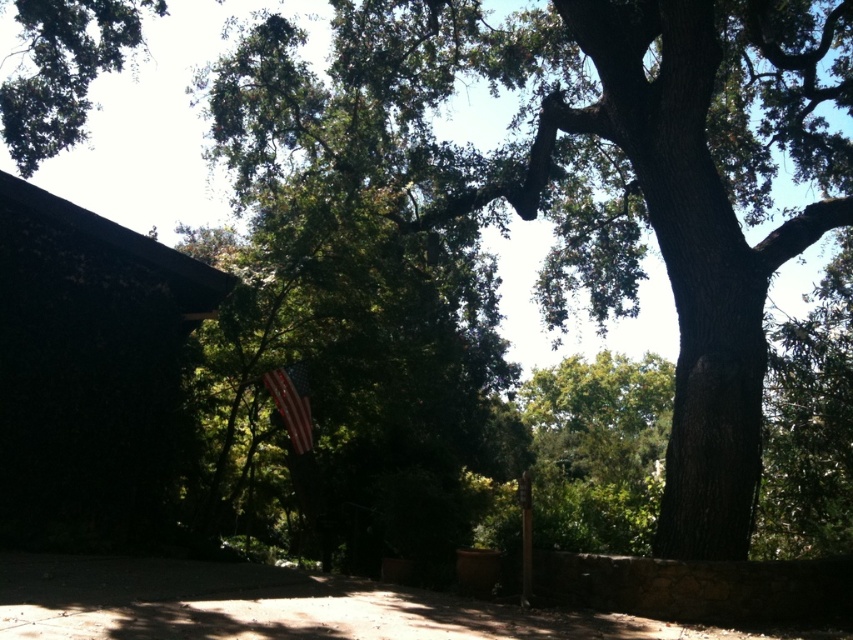
You are planning to install a bench between the smooth bark oak tree at center and the green leafy tree at upper left. The bench requires a minimum of 5 meters of space between the two trees to be placed safely. Can you install the bench in this location?

The distance between the smooth bark oak tree at center and the green leafy tree at upper left is 6.85 meters, which exceeds the required 5 meters. Therefore, the bench can be safely installed in this location.

You are standing in the park and want to take a photo of the american flag at center without the green leafy tree at upper left blocking it. Which direction should you move to ensure the flag is visible without obstruction?

The green leafy tree at upper left is in front of the american flag at center, so you should move to the right side of the scene to position yourself where the tree no longer blocks the flag.

You are standing in the park and want to take a photo of the smooth bark oak tree at center and the american flag at center. Which object should you focus on first if you want both to be in sharp focus?

You should focus on the smooth bark oak tree at center first because it is closer to the viewer than the american flag at center, ensuring both will be in focus when using a small aperture or adjusting the focus point accordingly.